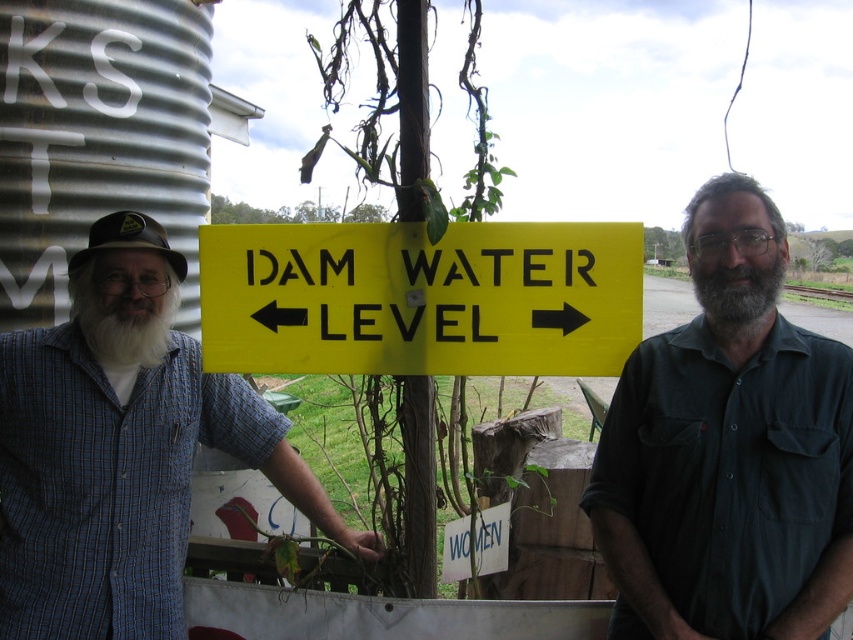
Can you confirm if dark green shirt at center is thinner than blue plaid shirt at left?

Yes.

Is dark green shirt at center wider than blue plaid shirt at left?

No, dark green shirt at center is not wider than blue plaid shirt at left.

Which is behind, point (645, 435) or point (108, 570)?

Point (108, 570)

Where is `dark green shirt at center`? dark green shirt at center is located at coordinates point(728,451).

Is blue plaid shirt at left to the left of yellow plastic sign at center from the viewer's perspective?

Indeed, blue plaid shirt at left is positioned on the left side of yellow plastic sign at center.

Describe the element at coordinates (122, 449) in the screenshot. Image resolution: width=853 pixels, height=640 pixels. I see `blue plaid shirt at left` at that location.

Find the location of a particular element. blue plaid shirt at left is located at coordinates (122, 449).

Between point (735, 586) and point (711, 314), which one is positioned behind?

Positioned behind is point (711, 314).

Who is shorter, dark green shirt at center or gray matte beard at center?

With less height is gray matte beard at center.

This screenshot has height=640, width=853. I want to click on dark green shirt at center, so click(x=728, y=451).